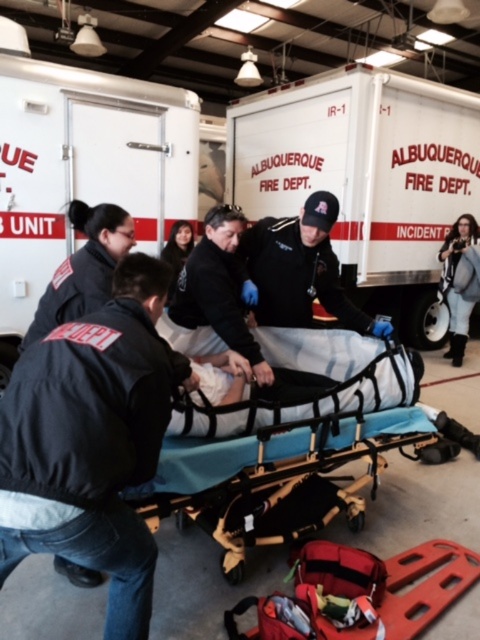
Question: Where is black fabric jacket at lower left located in relation to red plastic stretcher at center in the image?

Choices:
 (A) right
 (B) left

Answer: (B)

Question: Which object is farther from the camera taking this photo?

Choices:
 (A) black matte jacket at center
 (B) black matte uniform at center
 (C) metallic stretcher at center

Answer: (B)

Question: Which point appears closest to the camera in this image?

Choices:
 (A) (144, 394)
 (B) (71, 268)
 (C) (272, 612)
 (D) (325, 273)

Answer: (A)

Question: Observing the image, what is the correct spatial positioning of black matte jacket at center in reference to gray fabric jacket at upper right?

Choices:
 (A) left
 (B) right

Answer: (A)

Question: Considering the real-world distances, which object is farthest from the black uniform at center?

Choices:
 (A) metallic stretcher at center
 (B) black matte uniform at center

Answer: (B)

Question: Does metallic stretcher at center appear over black uniform at center?

Choices:
 (A) no
 (B) yes

Answer: (A)